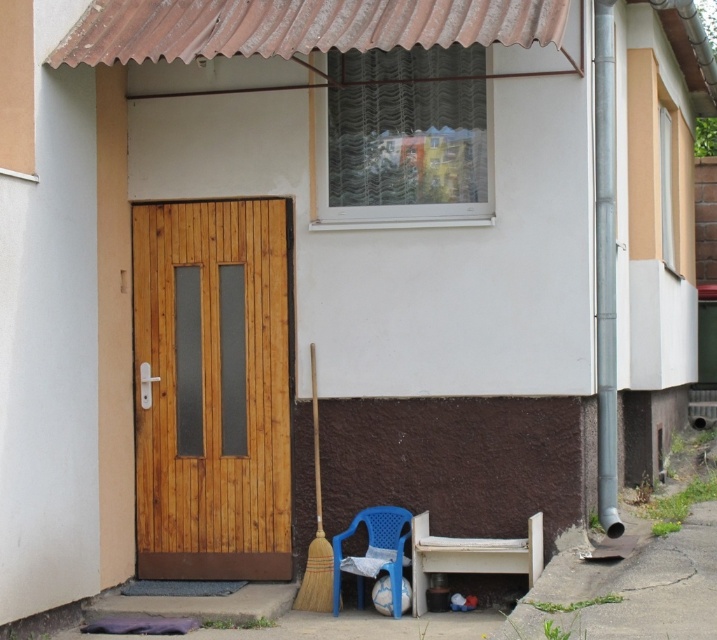
You are standing at the entrance of the residential building and need to locate the natural wood door at center. Based on the coordinates provided, can you determine its position relative to the entrance area?

The natural wood door at center is located at coordinates point (212, 390), which places it centrally positioned within the entrance area.

You are a delivery person with a large package that requires placing it on the nearest available surface. You see the natural wood door at center and the white matte bench at lower right. Which object can you place the package on?

The natural wood door at center has a larger size compared to the white matte bench at lower right, so the package can be placed on the natural wood door at center.

From the picture: You are a delivery person trying to place a large package on the ground near the entrance. The package is taller than the white matte bench at lower right. Can you place it in front of the natural wood door at center without blocking the door entirely?

The natural wood door at center is taller than the white matte bench at lower right. Since the package is taller than the bench, it may block the lower part of the door but not the entire door, as the door is taller. However, placing the package too close might still obstruct access. Consider placing it slightly to the side or behind the white matte bench at lower right to avoid blocking the entrance completely.